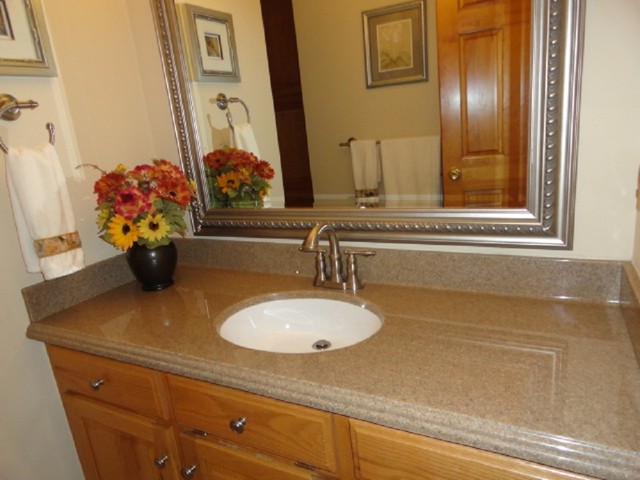
Where is `reflection of opened door`? This screenshot has height=480, width=640. reflection of opened door is located at coordinates (497, 84).